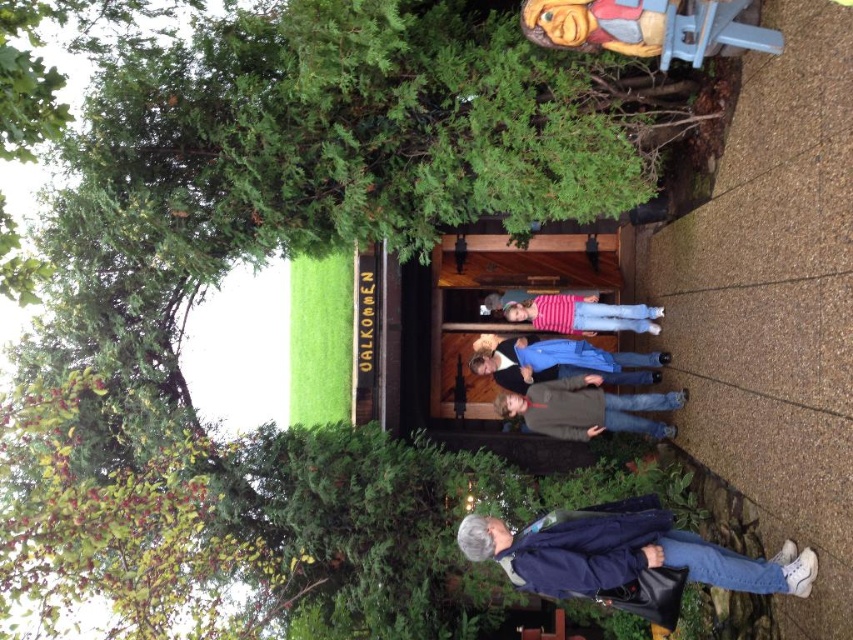
Question: Does dark gray sweater at center appear over striped cotton shirt at center?

Choices:
 (A) yes
 (B) no

Answer: (B)

Question: Among these points, which one is nearest to the camera?

Choices:
 (A) (618, 317)
 (B) (570, 364)

Answer: (B)

Question: Which object is farther from the camera taking this photo?

Choices:
 (A) dark gray sweater at center
 (B) striped cotton shirt at center

Answer: (B)

Question: Is the position of dark gray sweater at center less distant than that of blue denim jacket at center?

Choices:
 (A) no
 (B) yes

Answer: (B)

Question: Is dark blue jacket at lower right above striped cotton shirt at center?

Choices:
 (A) no
 (B) yes

Answer: (A)

Question: Which of these objects is positioned farthest from the blue denim jacket at center?

Choices:
 (A) dark blue jacket at lower right
 (B) striped cotton shirt at center
 (C) dark gray sweater at center

Answer: (A)